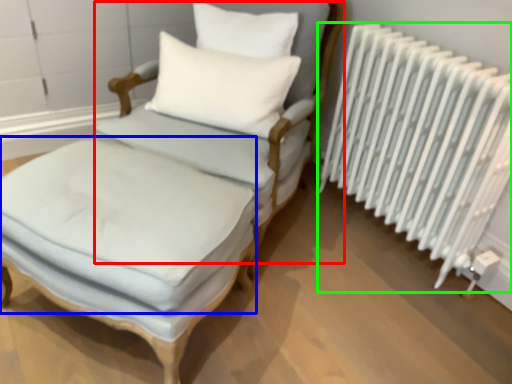
Question: Which is nearer to the armchair (highlighted by a red box)? mattress (highlighted by a blue box) or radiator (highlighted by a green box).

Choices:
 (A) mattress
 (B) radiator

Answer: (A)